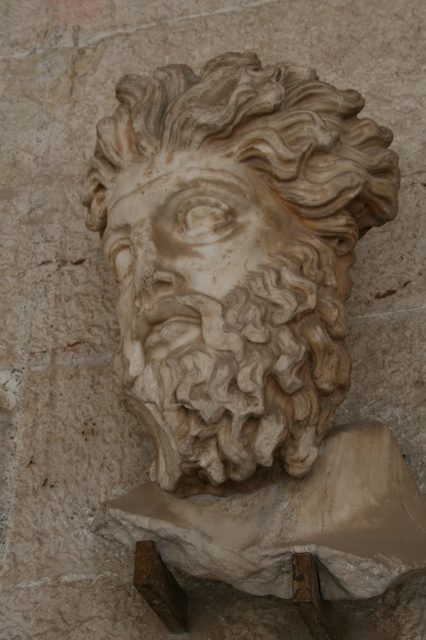
You are an art conservator examining a classical marble sculpture. You notice two white marble elements at the center of the scene. Which one is taller between the white marble lion at center and the white marble face at center?

The white marble lion at center is taller than the white marble face at center according to the description.